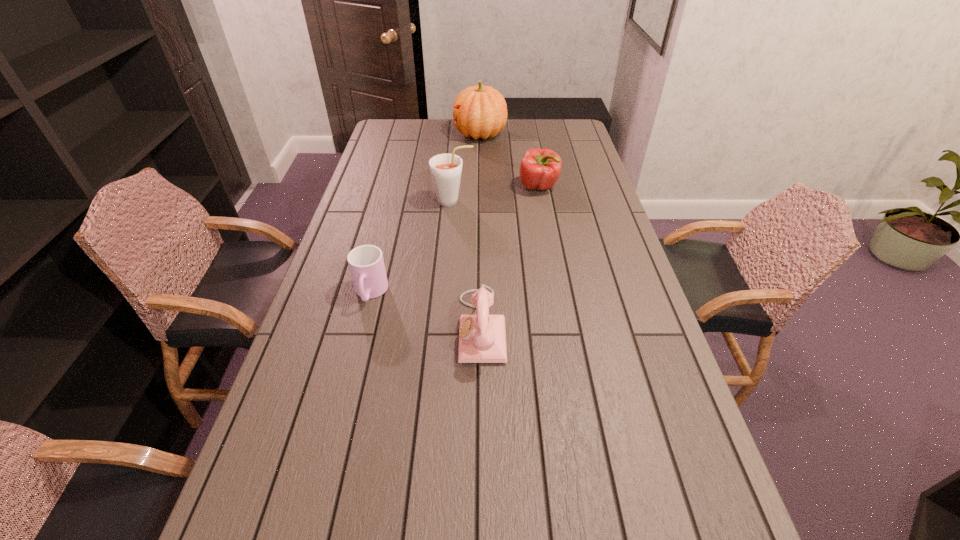
Locate an element on the screen. free space located on the drink side of the root beer is located at coordinates (529, 201).

Image resolution: width=960 pixels, height=540 pixels. In order to click on free space located on the front of the bell pepper in this screenshot , I will do `click(549, 242)`.

Locate an element on the screen. vacant space located on the dial of the telephone is located at coordinates (401, 326).

Where is `free location located 0.370m on the dial of the telephone`? free location located 0.370m on the dial of the telephone is located at coordinates (319, 326).

The width and height of the screenshot is (960, 540). In order to click on vacant space located on the dial of the telephone in this screenshot , I will do `click(428, 326)`.

The width and height of the screenshot is (960, 540). I want to click on free space located 0.100m with the handle on the side of the cup, so click(358, 340).

The width and height of the screenshot is (960, 540). What are the coordinates of `object that is at the far edge` in the screenshot? It's located at (480, 111).

The width and height of the screenshot is (960, 540). In order to click on object located at the left edge in this screenshot , I will do `click(366, 263)`.

Where is `object that is at the right edge`? This screenshot has width=960, height=540. object that is at the right edge is located at coordinates [x=540, y=168].

Where is `vacant space at the far edge of the desktop`? Image resolution: width=960 pixels, height=540 pixels. vacant space at the far edge of the desktop is located at coordinates (436, 129).